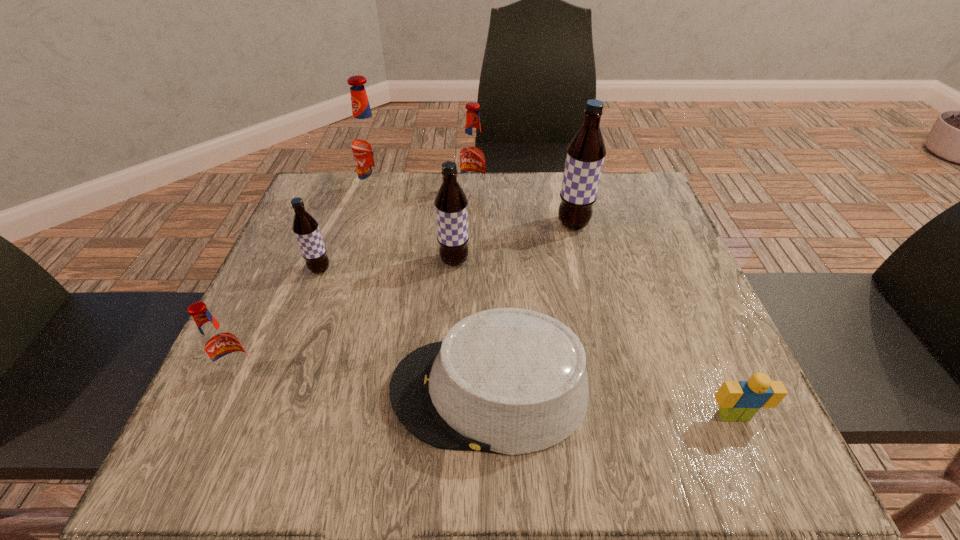
Locate an element on the screen. The image size is (960, 540). hat is located at coordinates (510, 381).

The width and height of the screenshot is (960, 540). I want to click on the rightmost object, so click(739, 401).

Where is `Lego`? Lego is located at coordinates (739, 401).

The width and height of the screenshot is (960, 540). What are the coordinates of `vacant region located 0.060m on the left of the sixth object from right to left` in the screenshot? It's located at (340, 194).

You are a GUI agent. You are given a task and a screenshot of the screen. Output one action in this format:
    pyautogui.click(x=<x>, y=<y>)
    Task: Click on the vacant space situated 0.070m on the right of the rightmost brown root beer
    This screenshot has height=540, width=960.
    Given the screenshot: What is the action you would take?
    pyautogui.click(x=619, y=224)

You are a GUI agent. You are given a task and a screenshot of the screen. Output one action in this format:
    pyautogui.click(x=<x>, y=<y>)
    Task: Click on the free space located on the front of the second biggest red root beer
    The width and height of the screenshot is (960, 540).
    Given the screenshot: What is the action you would take?
    pyautogui.click(x=473, y=239)

Where is `free space located 0.150m on the left of the second biggest brown root beer`? This screenshot has width=960, height=540. free space located 0.150m on the left of the second biggest brown root beer is located at coordinates (372, 261).

The height and width of the screenshot is (540, 960). I want to click on vacant area situated 0.200m on the front of the fifth root beer from right to left, so click(288, 356).

Identify the location of vacant space located on the front of the nearest root beer. This screenshot has height=540, width=960. (202, 464).

You are a GUI agent. You are given a task and a screenshot of the screen. Output one action in this format:
    pyautogui.click(x=<x>, y=<y>)
    Task: Click on the free space located on the front-facing side of the hat
    Image resolution: width=960 pixels, height=540 pixels.
    Given the screenshot: What is the action you would take?
    pyautogui.click(x=231, y=391)